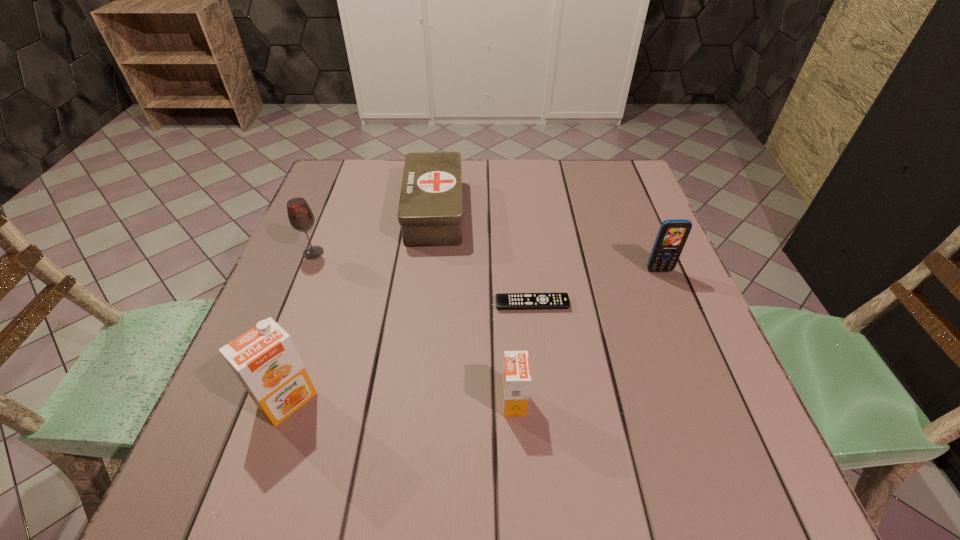
Where is `the third farthest object`? the third farthest object is located at coordinates (672, 235).

Find the location of a particular element. The height and width of the screenshot is (540, 960). free point located 0.260m on the right of the left orange juice is located at coordinates (462, 400).

The width and height of the screenshot is (960, 540). In order to click on vacant area located on the right of the shorter orange juice in this screenshot , I will do `click(598, 402)`.

At what (x,y) coordinates should I click in order to perform the action: click on vacant space located 0.250m on the left of the fourth object from right to left. Please return your answer as a coordinate pair (x, y). The height and width of the screenshot is (540, 960). Looking at the image, I should click on (310, 211).

Locate an element on the screen. The image size is (960, 540). vacant space located on the back of the glass drink container is located at coordinates (345, 175).

You are a GUI agent. You are given a task and a screenshot of the screen. Output one action in this format:
    pyautogui.click(x=<x>, y=<y>)
    Task: Click on the free space located 0.190m on the front of the shortest object
    The width and height of the screenshot is (960, 540).
    Given the screenshot: What is the action you would take?
    pyautogui.click(x=542, y=392)

At what (x,y) coordinates should I click in order to perform the action: click on vacant space located on the screen of the rightmost object. Please return your answer as a coordinate pair (x, y). Looking at the image, I should click on tap(697, 362).

Locate an element on the screen. object at the far edge is located at coordinates (430, 212).

Where is `orange juice at the left edge`? This screenshot has height=540, width=960. orange juice at the left edge is located at coordinates (265, 360).

In order to click on glass drink container positioned at the left edge in this screenshot , I will do `click(301, 218)`.